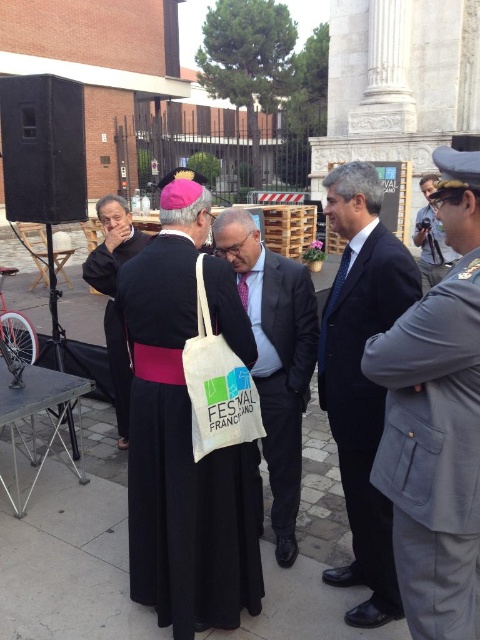
You are organizing a charity event and need to place a small donation box next to the dark blue suit at center and the white fabric tote bag at center. Based on their sizes, which object should the donation box be placed closer to?

The donation box should be placed closer to the white fabric tote bag at center because the dark blue suit at center is smaller in size compared to the white fabric tote bag at center, so the donation box can be positioned near the larger item to ensure visibility.

In the scene described, there are two individuals wearing dark blue suit at center and black velvet robe at left. Which person is taller?

The dark blue suit at center is taller than the black velvet robe at left.